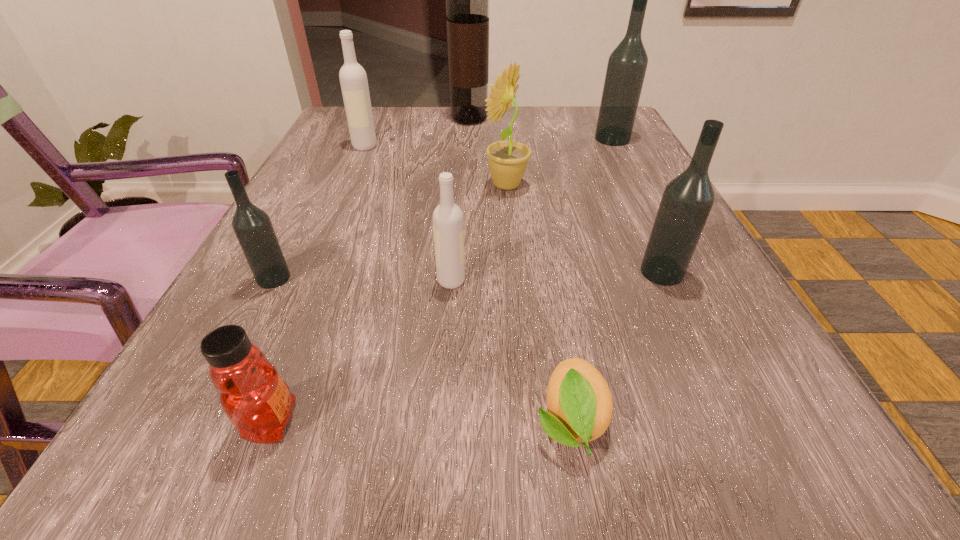
The height and width of the screenshot is (540, 960). I want to click on object at the far left corner, so point(353,79).

At what (x,y) coordinates should I click in order to perform the action: click on object located at the near left corner. Please return your answer as a coordinate pair (x, y). This screenshot has height=540, width=960. Looking at the image, I should click on (254, 397).

You are a GUI agent. You are given a task and a screenshot of the screen. Output one action in this format:
    pyautogui.click(x=<x>, y=<y>)
    Task: Click on the object that is at the far right corner
    
    Given the screenshot: What is the action you would take?
    pyautogui.click(x=627, y=64)

This screenshot has height=540, width=960. I want to click on free space at the far edge of the desktop, so click(x=461, y=145).

Find the location of a particular element. The width and height of the screenshot is (960, 540). free space at the near edge is located at coordinates (357, 476).

This screenshot has width=960, height=540. I want to click on free spot at the left edge of the desktop, so click(366, 179).

In order to click on vacant space at the right edge of the desktop in this screenshot , I will do `click(754, 382)`.

I want to click on vacant space at the near right corner, so click(x=793, y=446).

Where is `free space between the tallest object and the farthest black vodka`? The image size is (960, 540). free space between the tallest object and the farthest black vodka is located at coordinates (540, 129).

The height and width of the screenshot is (540, 960). I want to click on unoccupied position between the third vodka from right to left and the left white vodka, so click(x=408, y=213).